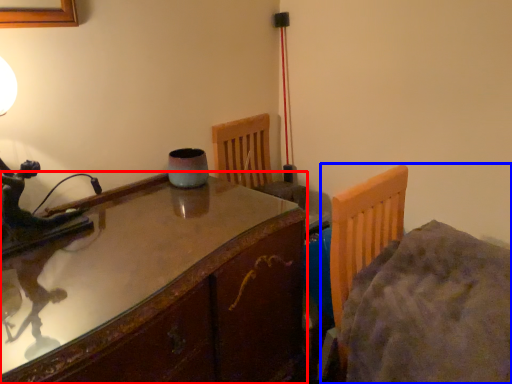
Question: Which object appears closest to the camera in this image, table (highlighted by a red box) or bed (highlighted by a blue box)?

Choices:
 (A) table
 (B) bed

Answer: (A)